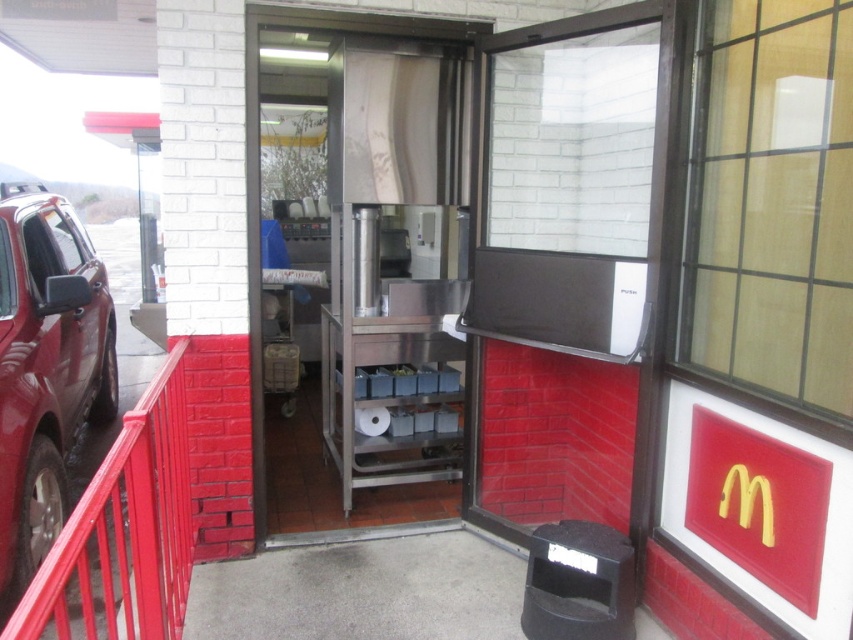
You are a delivery driver arriving at the McDonalds entrance. You see a shiny dark red suv at left and a red metal railing at left. Which object is closer to the entrance door?

The shiny dark red suv at left is positioned over the red metal railing at left, meaning it is closer to the entrance door than the railing.

You are a delivery person trying to enter the McDonalds entrance. The clear glass door at center is partially open. Can you fit through the opening if you carry a large box that is as wide as the red metal railing at left?

The clear glass door at center is smaller than the red metal railing at left, so the opening is narrower than the box. The large box cannot fit through the opening.

You are a delivery person with a large box that is 1.2 meters wide. You need to enter the McDonalds through the entrance shown. Can your box fit through the clear glass door at center if you place it next to the red metal railing at left?

The clear glass door at center is narrower than the red metal railing at left. Since the box is 1.2 meters wide, and the door is narrower than the railing, it is likely too narrow to fit the box through. You may need to find a wider entrance or repackage the box to a smaller size.